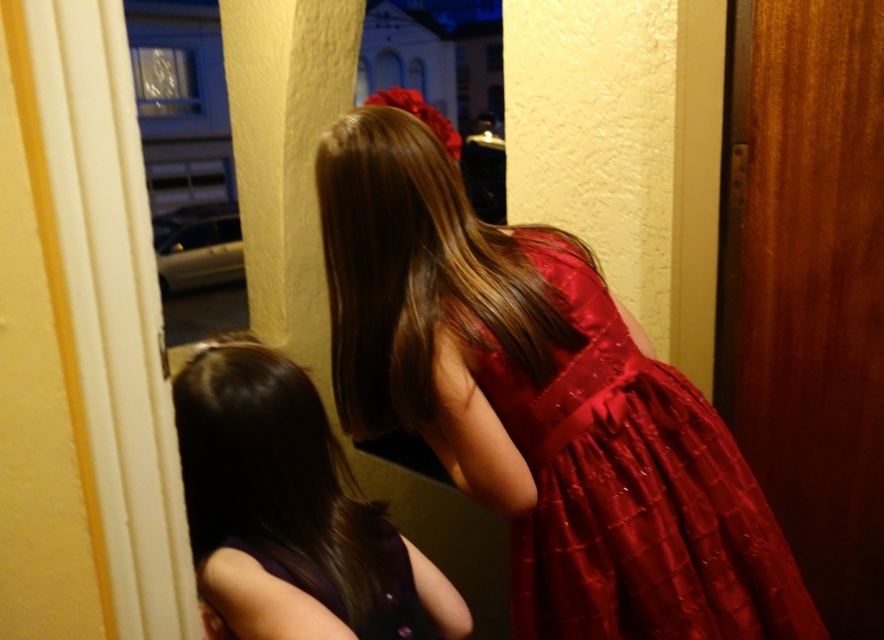
You are a photographer setting up a shoot in this scene. You want to capture both the shiny red dress at center and the shiny purple dress at lower left in the same frame. Which dress should you focus on first to ensure both are in focus?

You should focus on the shiny red dress at center first because it is closer to the viewer than the shiny purple dress at lower left. By focusing on the closer object, the depth of field may allow the farther object to still be in acceptable focus.

You are a fashion designer who wants to place a new accessory between the shiny red dress at center and the shiny purple dress at lower left. What is the minimum distance the accessory should be placed from each dress to ensure it is centered between them?

The shiny red dress at center is 26.17 centimeters away from the shiny purple dress at lower left. To center the accessory between them, it should be placed 13.085 centimeters away from each dress.

You are a photographer trying to capture a shot of the shiny brown hair at center and the purple satin dress at lower left. Since the camera can only focus on one subject at a time, which one should you choose to ensure it appears sharp in the photo?

The shiny brown hair at center is located above the purple satin dress at lower left, so it is closer to the camera. Therefore, focusing on the shiny brown hair at center will ensure it appears sharp, while the purple satin dress at lower left may be slightly out of focus due to its distance from the camera.